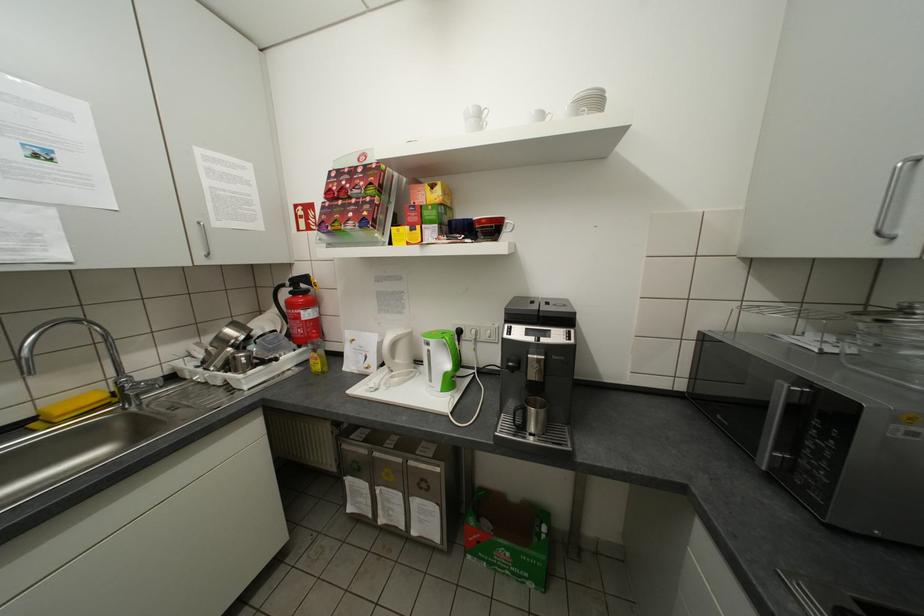
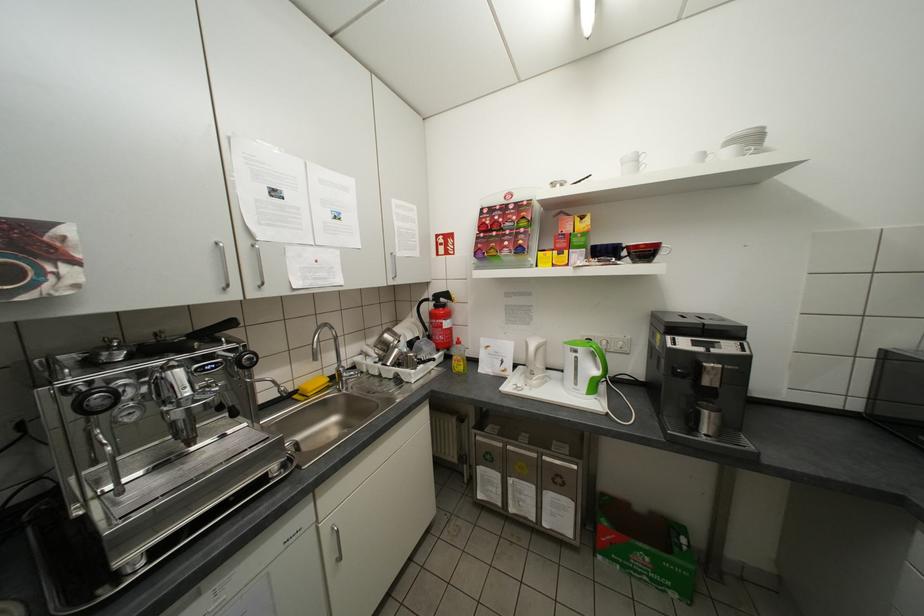
Find the pixel in the second image that matches point 299,293 in the first image.

(444, 306)